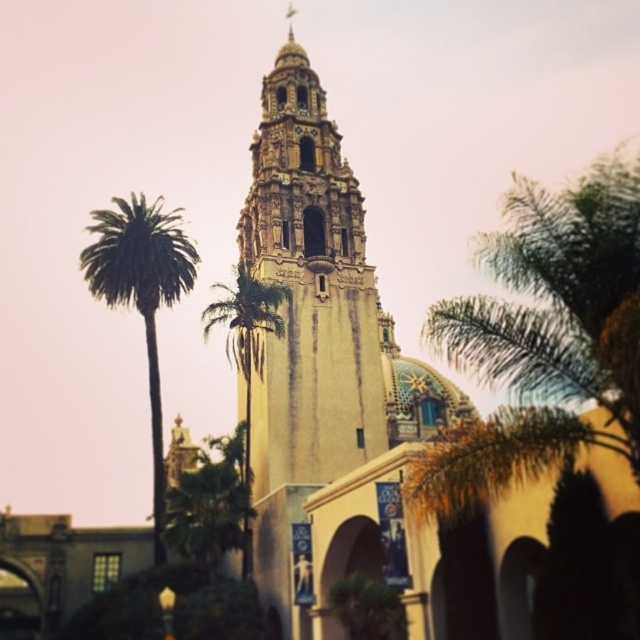
You are standing in front of the beige stone bell tower at center and want to take a photo of the green leafy palm tree at left. Will the palm tree be fully visible in the photo if you frame the shot to include the entire height of the tower?

The beige stone bell tower at center is much taller than the green leafy palm tree at left, so the palm tree will be fully visible in the photo when framing the entire height of the tower.

You are standing in front of the Spanish Colonial Revival building and notice the beige stone bell tower at center and the green leafy palm tree at center. From your perspective, which object is positioned to the right?

The beige stone bell tower at center is positioned to the right of the green leafy palm tree at center.

Consider the image. You are standing in front of the Spanish Colonial Revival building and want to take a photo of the point at coordinates point [310,291]. If your camera has a maximum focus range of 70 meters, will it be able to focus on that point?

The distance of point [310,291] from camera is 72.88 meters, which exceeds the camera maximum focus range of 70 meters. Therefore, the camera cannot focus on that point.